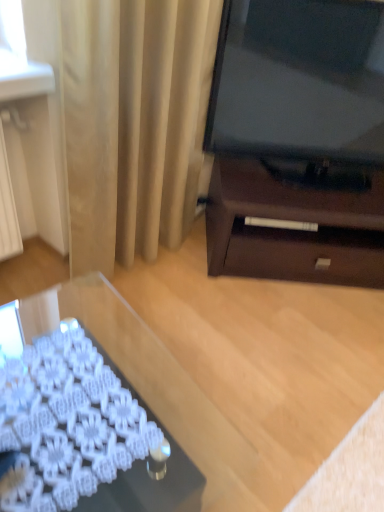
Question: Looking at their shapes, would you say transparent glass desk at lower left is wider or thinner than beige fabric curtain at upper left?

Choices:
 (A) thin
 (B) wide

Answer: (B)

Question: Considering the relative positions of transparent glass desk at lower left and beige fabric curtain at upper left in the image provided, is transparent glass desk at lower left to the left or to the right of beige fabric curtain at upper left?

Choices:
 (A) left
 (B) right

Answer: (A)

Question: From a real-world perspective, is transparent glass desk at lower left physically located above or below beige fabric curtain at upper left?

Choices:
 (A) below
 (B) above

Answer: (A)

Question: In terms of width, does beige fabric curtain at upper left look wider or thinner when compared to transparent glass desk at lower left?

Choices:
 (A) thin
 (B) wide

Answer: (A)

Question: From the image's perspective, relative to transparent glass desk at lower left, is beige fabric curtain at upper left above or below?

Choices:
 (A) above
 (B) below

Answer: (A)

Question: Considering the positions of beige fabric curtain at upper left and transparent glass desk at lower left in the image, is beige fabric curtain at upper left bigger or smaller than transparent glass desk at lower left?

Choices:
 (A) small
 (B) big

Answer: (A)

Question: Considering the relative positions of beige fabric curtain at upper left and transparent glass desk at lower left in the image provided, is beige fabric curtain at upper left to the left or to the right of transparent glass desk at lower left?

Choices:
 (A) left
 (B) right

Answer: (B)